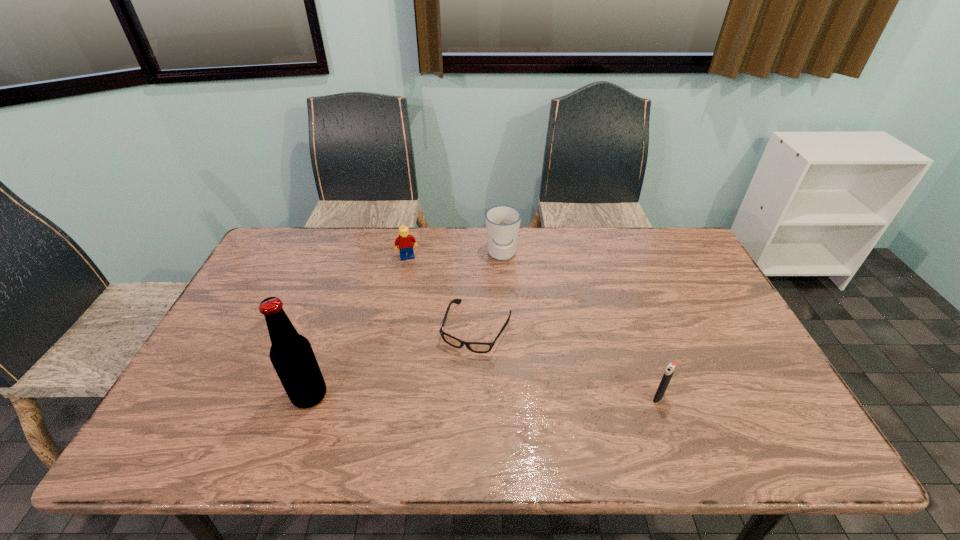
You are a GUI agent. You are given a task and a screenshot of the screen. Output one action in this format:
    pyautogui.click(x=<x>, y=<y>)
    Task: Click on the vacant point located 0.240m with a handle on the side of the cup
    Image resolution: width=960 pixels, height=540 pixels.
    Given the screenshot: What is the action you would take?
    pyautogui.click(x=493, y=320)

Identify the location of free space located 0.280m with a handle on the side of the cup. Image resolution: width=960 pixels, height=540 pixels. (492, 330).

Identify the location of free space located on the front-facing side of the shortest object. (446, 400).

This screenshot has height=540, width=960. Find the location of `vacant space located 0.190m on the front-facing side of the shortest object`. vacant space located 0.190m on the front-facing side of the shortest object is located at coordinates (439, 417).

In order to click on free spot located 0.370m on the front-facing side of the Lego in this screenshot , I will do `click(435, 343)`.

Find the location of a particular element. Image resolution: width=960 pixels, height=540 pixels. free point located on the front-facing side of the Lego is located at coordinates (427, 318).

Locate an element on the screen. vacant space located on the front-facing side of the Lego is located at coordinates (433, 335).

Where is `cup at the far edge`? cup at the far edge is located at coordinates (502, 222).

Where is `Lego located at the far edge`? Lego located at the far edge is located at coordinates (405, 241).

At what (x,y) coordinates should I click in order to perform the action: click on beer bottle at the near edge. Please return your answer as a coordinate pair (x, y). The width and height of the screenshot is (960, 540). Looking at the image, I should click on (291, 354).